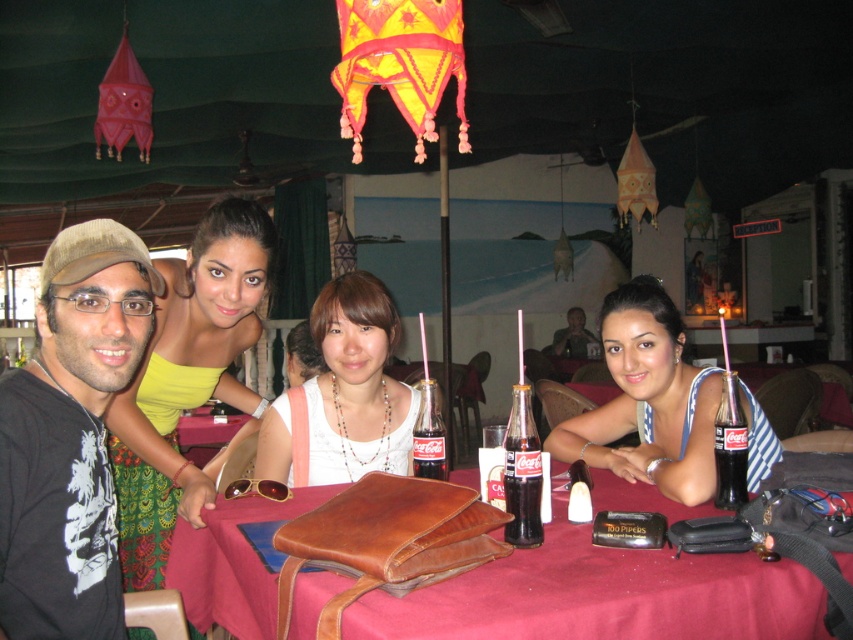
Question: Which object is closer to the camera taking this photo?

Choices:
 (A) blue striped dress at table right
 (B) black glass coca-cola bottle at table center
 (C) coca-cola glass bottle at table right

Answer: (B)

Question: Can you confirm if blue striped dress at table right is positioned to the right of black glass coca-cola bottle at table center?

Choices:
 (A) yes
 (B) no

Answer: (A)

Question: Estimate the real-world distances between objects in this image. Which object is closer to the blue striped dress at table right?

Choices:
 (A) yellow-green fabric dress at upper left
 (B) matte black laptop at center
 (C) black cotton shirt at left

Answer: (A)

Question: Does brown leather bag at center lie in front of matte black laptop at center?

Choices:
 (A) no
 (B) yes

Answer: (B)

Question: Where is blue striped dress at table right located in relation to coca-cola glass bottle at table right in the image?

Choices:
 (A) below
 (B) above

Answer: (B)

Question: Which object is the closest to the blue striped dress at table right?

Choices:
 (A) black glass coca-cola bottle at table center
 (B) translucent glass coca-cola bottle at center
 (C) white leather purse at center

Answer: (A)